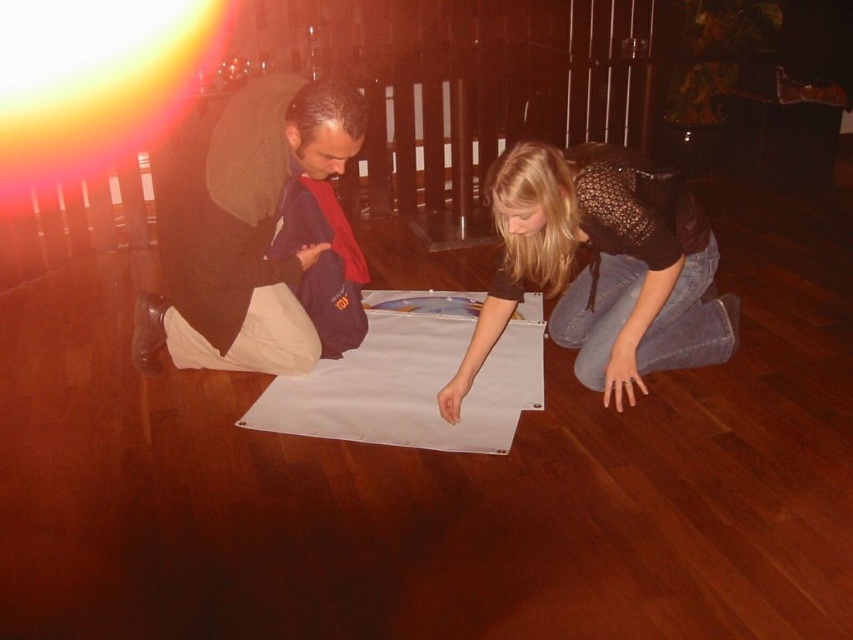
Is dark blue fabric at left behind denim jeans at lower right?

That is True.

In the scene shown: Is dark blue fabric at left above denim jeans at lower right?

Yes.

Which is in front, point (302, 253) or point (467, 376)?

Positioned in front is point (467, 376).

This screenshot has width=853, height=640. In order to click on dark blue fabric at left in this screenshot , I will do `click(259, 236)`.

From the picture: Is dark blue fabric at left shorter than white matte cloth at center?

Incorrect, dark blue fabric at left's height does not fall short of white matte cloth at center's.

Is dark blue fabric at left to the left of white matte cloth at center from the viewer's perspective?

Indeed, dark blue fabric at left is positioned on the left side of white matte cloth at center.

Image resolution: width=853 pixels, height=640 pixels. Identify the location of dark blue fabric at left. (259, 236).

Where is `dark blue fabric at left`? dark blue fabric at left is located at coordinates point(259,236).

Consider the image. Does denim jeans at lower right appear over white matte cloth at center?

Yes, denim jeans at lower right is above white matte cloth at center.

Where is `denim jeans at lower right`? denim jeans at lower right is located at coordinates (601, 269).